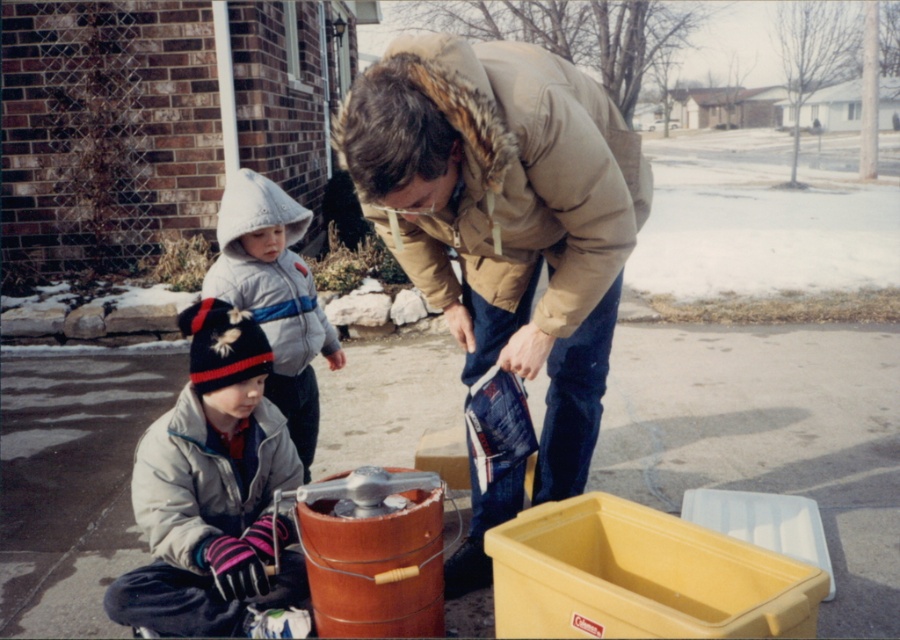
In order to click on tan fur-trimmed coat at center in this screenshot , I will do `click(505, 214)`.

Is point (543, 260) positioned after point (259, 259)?

Yes, point (543, 260) is behind point (259, 259).

This screenshot has height=640, width=900. I want to click on tan fur-trimmed coat at center, so click(x=505, y=214).

Does white fleece jacket at lower left appear on the right side of knitted wool hat at lower left?

No, white fleece jacket at lower left is not to the right of knitted wool hat at lower left.

Can you confirm if white fleece jacket at lower left is taller than knitted wool hat at lower left?

Incorrect, white fleece jacket at lower left's height is not larger of knitted wool hat at lower left's.

Between point (236, 611) and point (274, 324), which one is positioned behind?

The point (274, 324) is behind.

I want to click on white fleece jacket at lower left, so click(212, 490).

Based on the photo, which is more to the left, tan fur-trimmed coat at center or white fleece jacket at lower left?

From the viewer's perspective, white fleece jacket at lower left appears more on the left side.

Does tan fur-trimmed coat at center have a larger size compared to white fleece jacket at lower left?

Indeed, tan fur-trimmed coat at center has a larger size compared to white fleece jacket at lower left.

Is point (541, 192) farther from camera compared to point (266, 460)?

That is False.

What are the coordinates of `tan fur-trimmed coat at center` in the screenshot? It's located at (505, 214).